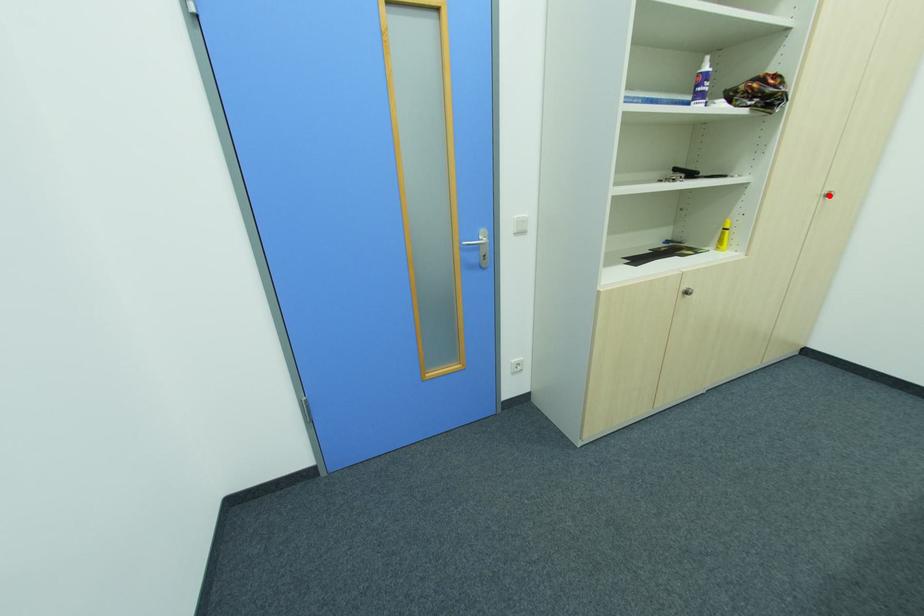
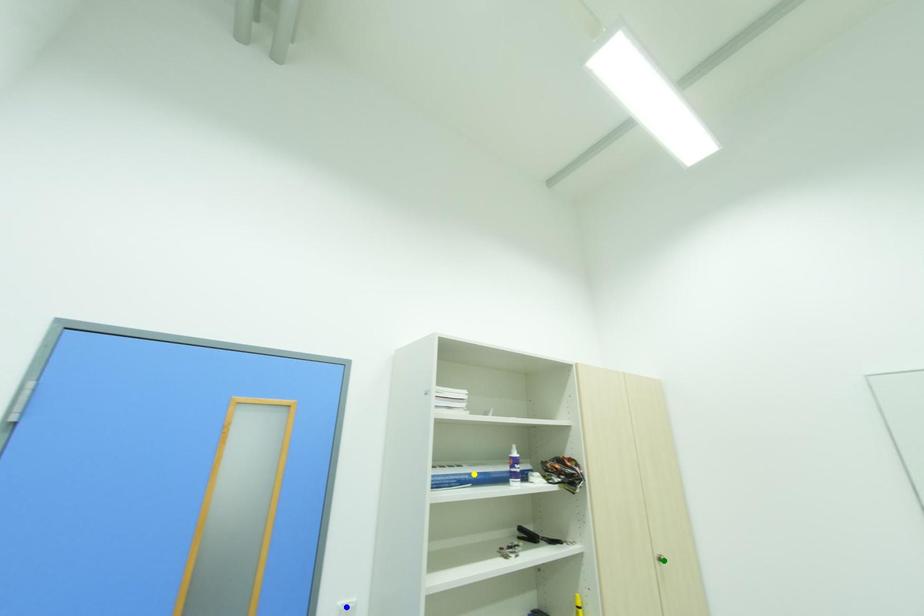
Question: I am providing you with two images of the same scene from different viewpoints. A red point is marked on the first image. You are given multiple points on the second image. Which point in image 2 represents the same 3d spot as the red point in image 1?

Choices:
 (A) blue point
 (B) yellow point
 (C) green point

Answer: (C)